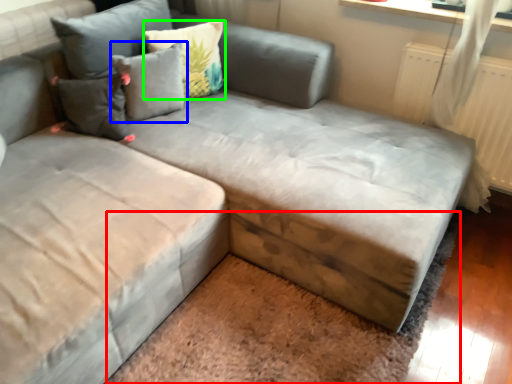
Question: Which object is positioned closest to mat (highlighted by a red box)? Select from pillow (highlighted by a blue box) and pillow (highlighted by a green box).

Choices:
 (A) pillow
 (B) pillow

Answer: (A)